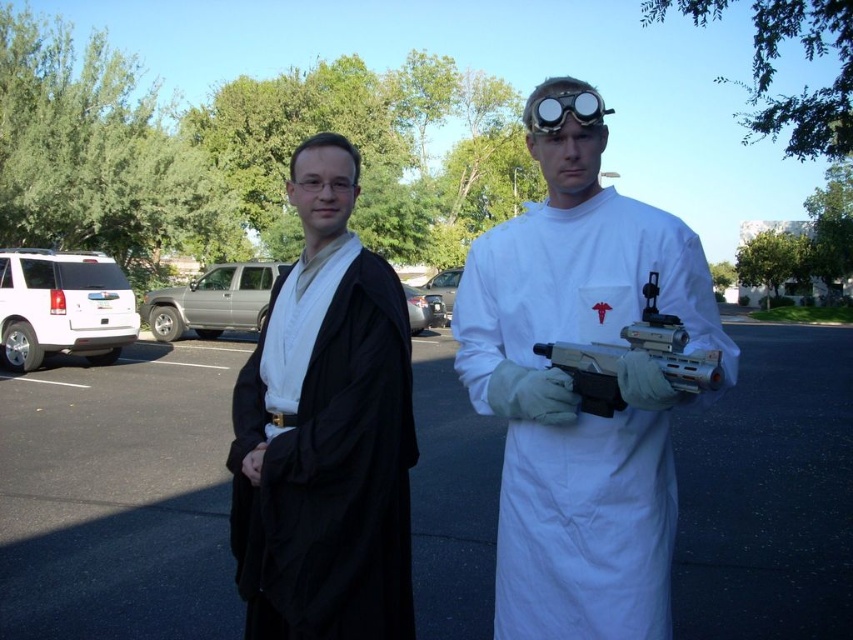
You are a photographer setting up a tripod to take a portrait of the two characters. The tripod has a height adjustment that can only go up to 1.2 meters. The asphalt at center and metallic plastic gun at center are in the foreground. Will the tripod be tall enough to ensure the camera is positioned above both objects?

The asphalt at center is taller than the metallic plastic gun at center. Since the tripod can reach up to 1.2 meters, it should be sufficient to position the camera above both objects as long as their heights are below this limit. However, without specific measurements, we can infer that since asphalt is taller but likely part of the ground, the tripod height should accommodate the scene.